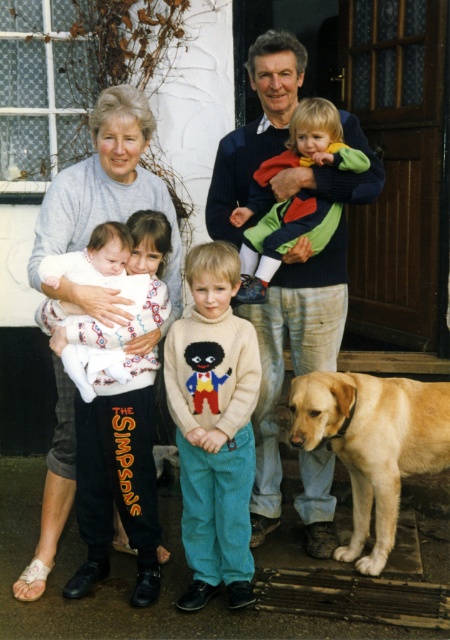
Question: Estimate the real-world distances between objects in this image. Which object is closer to the knitted sweater at center?

Choices:
 (A) light brown fur dog at center
 (B) green corduroy sweater at center
 (C) white soft fabric baby at lower left

Answer: (C)

Question: Does light brown fur dog at center have a larger size compared to gray sweater at left?

Choices:
 (A) yes
 (B) no

Answer: (A)

Question: Based on their relative distances, which object is nearer to the golden fur dog at lower right?

Choices:
 (A) gray sweater at left
 (B) light brown fur dog at center
 (C) green corduroy sweater at center

Answer: (B)

Question: Observing the image, what is the correct spatial positioning of knitted sweater at center in reference to golden fur dog at lower right?

Choices:
 (A) right
 (B) left

Answer: (B)

Question: Is golden fur dog at lower right smaller than white soft fabric baby at lower left?

Choices:
 (A) no
 (B) yes

Answer: (A)

Question: Among these objects, which one is nearest to the camera?

Choices:
 (A) knitted sweater at center
 (B) golden fur dog at lower right
 (C) light brown fur dog at center

Answer: (B)